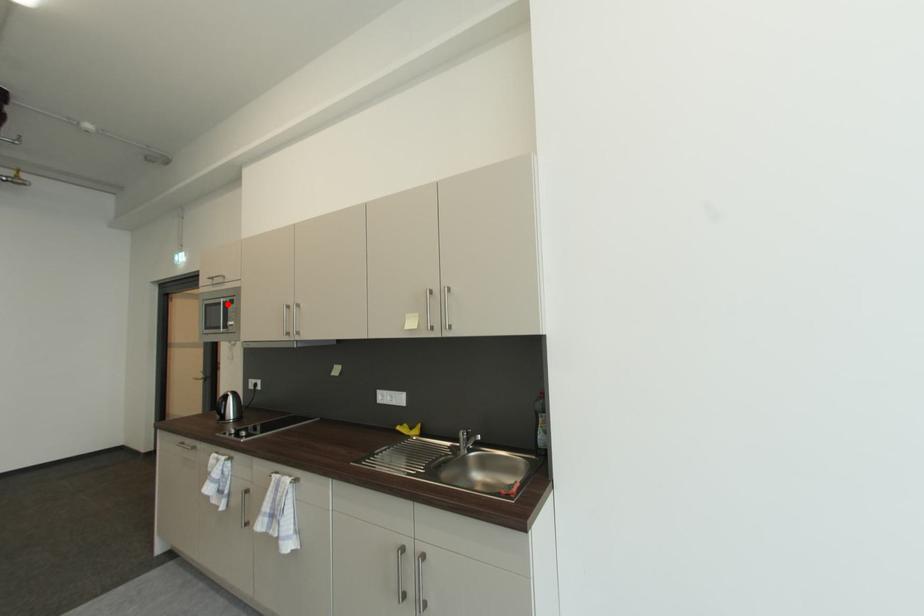
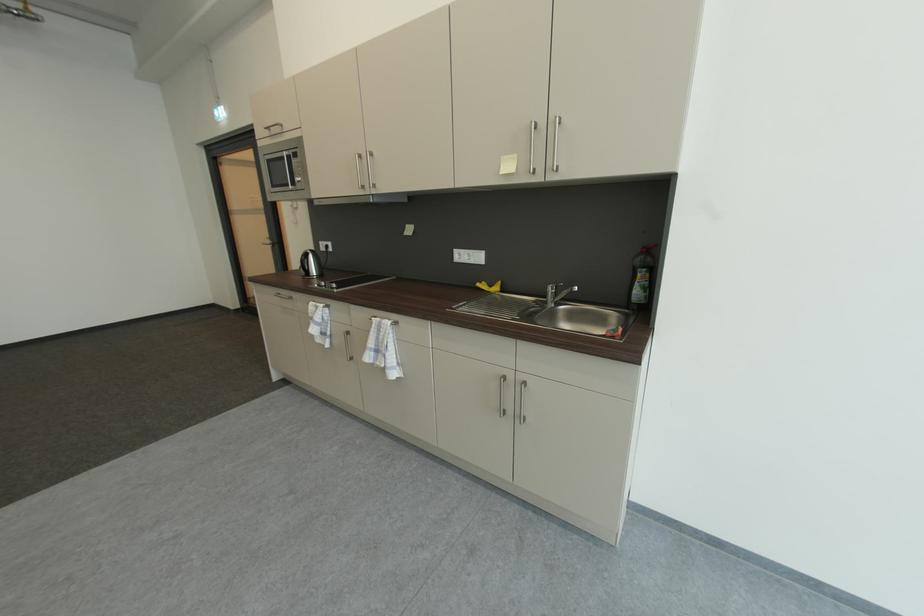
Locate, in the second image, the point that corresponds to the highlighted location in the first image.

(290, 158)